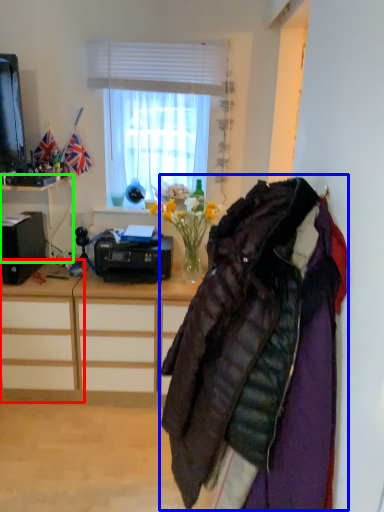
Question: Based on their relative distances, which object is farther from desk (highlighted by a red box)? Choose from jacket (highlighted by a blue box) and desk (highlighted by a green box).

Choices:
 (A) jacket
 (B) desk

Answer: (A)